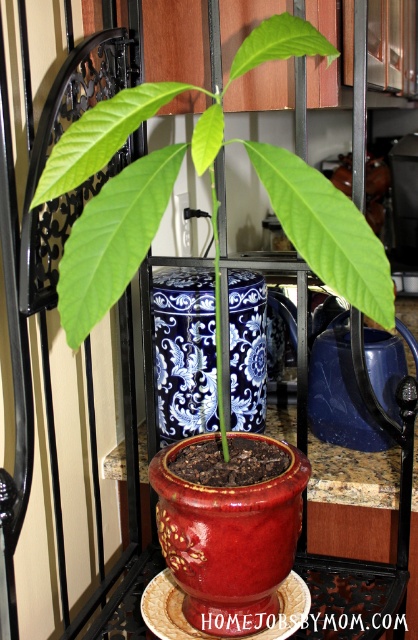
Question: Which of the following is the farthest from the observer?

Choices:
 (A) glossy ceramic pot at center
 (B) blue and white porcelain vase at center

Answer: (B)

Question: Among these objects, which one is farthest from the camera?

Choices:
 (A) glossy ceramic pot at center
 (B) red glossy pot at center
 (C) blue and white porcelain vase at center

Answer: (C)

Question: Is glossy ceramic pot at center to the left of red glossy pot at center from the viewer's perspective?

Choices:
 (A) yes
 (B) no

Answer: (A)

Question: Where is glossy ceramic pot at center located in relation to red glossy pot at center in the image?

Choices:
 (A) left
 (B) right

Answer: (A)

Question: Is glossy ceramic pot at center further to camera compared to red glossy pot at center?

Choices:
 (A) no
 (B) yes

Answer: (A)

Question: Which object is the closest to the glossy ceramic pot at center?

Choices:
 (A) blue and white porcelain vase at center
 (B) red glossy pot at center

Answer: (B)